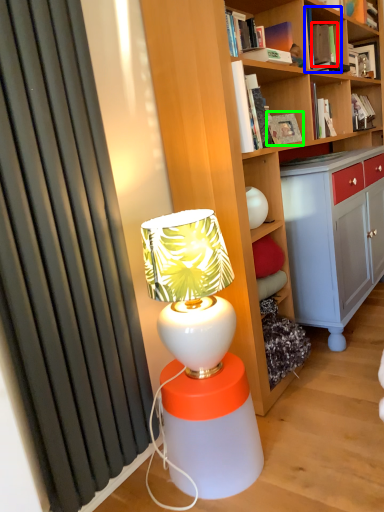
Question: Which object is positioned closest to book (highlighted by a red box)? Select from book (highlighted by a blue box) and book (highlighted by a green box).

Choices:
 (A) book
 (B) book

Answer: (A)